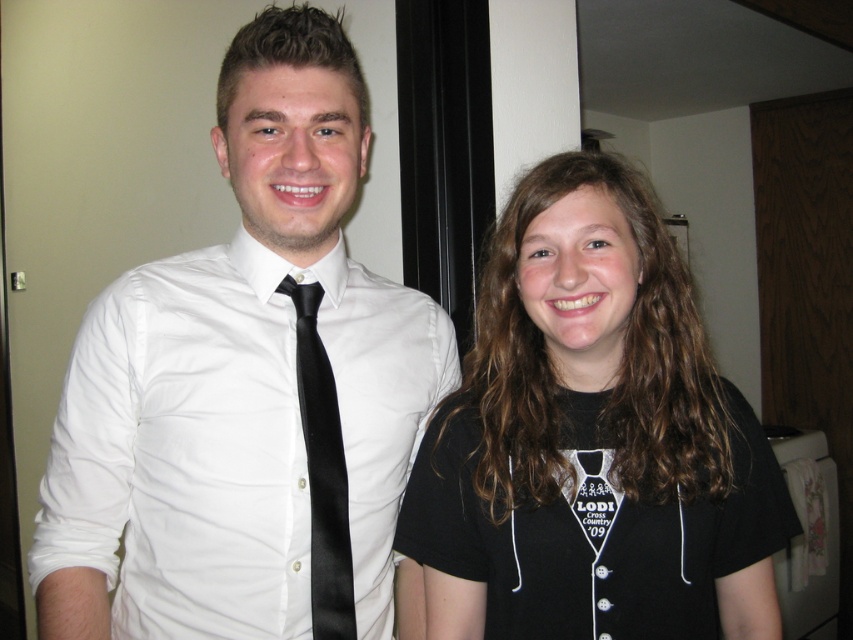
You are a photographer adjusting your camera settings to focus on the white satin shirt at center and the black satin tie at center. Which one should you focus on first to ensure both are in sharp focus?

The white satin shirt at center is closer to the viewer than the black satin tie at center, so you should focus on the white satin shirt at center first to ensure both are in sharp focus.